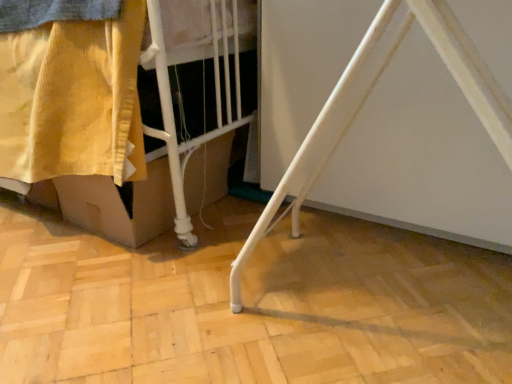
What is the approximate height of white glossy bed at center?

white glossy bed at center is 21.46 inches tall.

What is the approximate width of white glossy bed at center?

white glossy bed at center is 1.06 meters in width.

Describe the element at coordinates (173, 129) in the screenshot. The image size is (512, 384). I see `white glossy bed at center` at that location.

Measure the distance between white glossy bed at center and camera.

A distance of 30.06 inches exists between white glossy bed at center and camera.

Image resolution: width=512 pixels, height=384 pixels. I want to click on white glossy bed at center, so click(x=173, y=129).

Where is `white glossy bed at center`? Image resolution: width=512 pixels, height=384 pixels. white glossy bed at center is located at coordinates [173, 129].